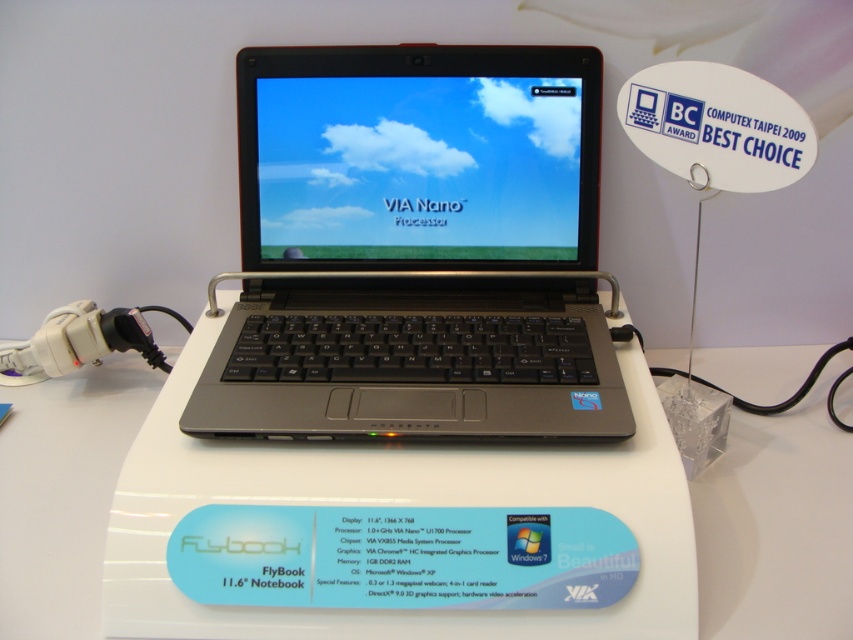
Does point (265, 342) lie in front of point (703, 598)?

No.

How much distance is there between satin black laptop at center and white plastic table at center?

satin black laptop at center is 34.40 centimeters from white plastic table at center.

You are a GUI agent. You are given a task and a screenshot of the screen. Output one action in this format:
    pyautogui.click(x=<x>, y=<y>)
    Task: Click on the satin black laptop at center
    The image size is (853, 640).
    Given the screenshot: What is the action you would take?
    [418, 157]

Locate an element on the screen. satin black laptop at center is located at coordinates (418, 157).